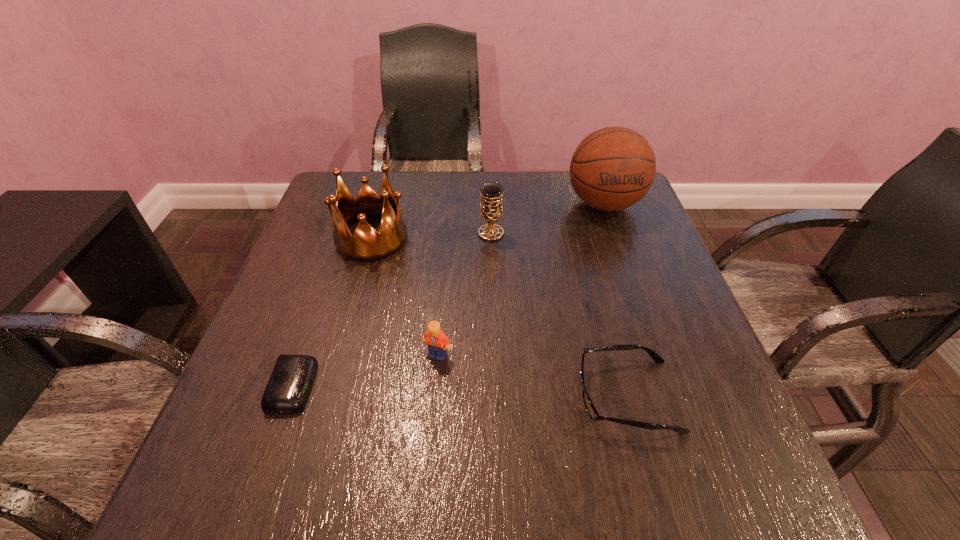
Where is `basketball located in the right edge section of the desktop`? basketball located in the right edge section of the desktop is located at coordinates (613, 168).

Find the location of a particular element. spectacles present at the right edge is located at coordinates (590, 408).

In order to click on object present at the far left corner in this screenshot , I will do `click(366, 245)`.

Identify the location of object situated at the far right corner. This screenshot has height=540, width=960. (613, 168).

Locate an element on the screen. The image size is (960, 540). free space at the far edge of the desktop is located at coordinates (441, 218).

Locate an element on the screen. The image size is (960, 540). free space at the near edge of the desktop is located at coordinates (470, 492).

At what (x,y) coordinates should I click in order to perform the action: click on free space at the left edge of the desktop. Please return your answer as a coordinate pair (x, y). Looking at the image, I should click on (287, 327).

Image resolution: width=960 pixels, height=540 pixels. Identify the location of free spot at the right edge of the desktop. (692, 326).

Locate an element on the screen. free spot at the far left corner of the desktop is located at coordinates (332, 186).

Find the location of a particular element. vacant space at the near right corner of the desktop is located at coordinates (718, 460).